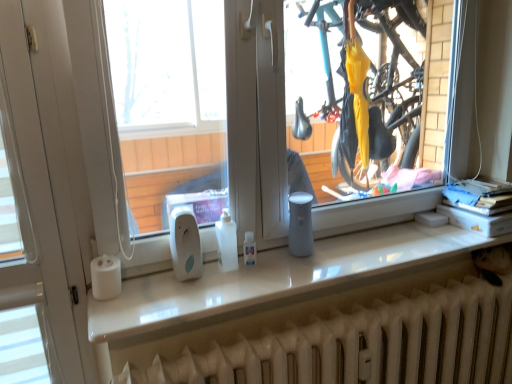
Question: Is white matte paper towel at left positioned with its back to white glossy counter top at center?

Choices:
 (A) no
 (B) yes

Answer: (A)

Question: Considering the relative sizes of white matte paper towel at left and white glossy counter top at center in the image provided, is white matte paper towel at left wider than white glossy counter top at center?

Choices:
 (A) yes
 (B) no

Answer: (B)

Question: Does white matte paper towel at left appear on the right side of white glossy counter top at center?

Choices:
 (A) yes
 (B) no

Answer: (B)

Question: Considering the relative sizes of white matte paper towel at left and white glossy counter top at center in the image provided, is white matte paper towel at left bigger than white glossy counter top at center?

Choices:
 (A) no
 (B) yes

Answer: (A)

Question: From the image's perspective, is white matte paper towel at left on top of white glossy counter top at center?

Choices:
 (A) no
 (B) yes

Answer: (A)

Question: Are white matte paper towel at left and white glossy counter top at center beside each other?

Choices:
 (A) no
 (B) yes

Answer: (A)

Question: Does white matte radiator at lower center come behind white matte paper towel at left?

Choices:
 (A) no
 (B) yes

Answer: (A)

Question: Is white matte paper towel at left completely or partially inside white matte radiator at lower center?

Choices:
 (A) no
 (B) yes

Answer: (A)

Question: Is white matte radiator at lower center aimed at white matte paper towel at left?

Choices:
 (A) yes
 (B) no

Answer: (B)

Question: Is white matte radiator at lower center bigger than white matte paper towel at left?

Choices:
 (A) yes
 (B) no

Answer: (A)

Question: From the image's perspective, is white matte radiator at lower center below white matte paper towel at left?

Choices:
 (A) yes
 (B) no

Answer: (A)

Question: Is the position of white matte radiator at lower center less distant than that of white matte paper towel at left?

Choices:
 (A) no
 (B) yes

Answer: (B)

Question: Considering the relative sizes of white glossy counter top at center and white matte paper towel at left in the image provided, is white glossy counter top at center taller than white matte paper towel at left?

Choices:
 (A) no
 (B) yes

Answer: (A)